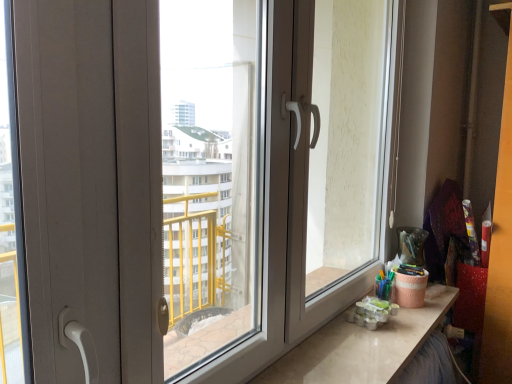
Question: Based on their sizes in the image, would you say transparent plastic window screen at center is bigger or smaller than matte white screen door at right?

Choices:
 (A) small
 (B) big

Answer: (A)

Question: Is point [x=162, y=119] closer or farther from the camera than point [x=354, y=241]?

Choices:
 (A) closer
 (B) farther

Answer: (A)

Question: Estimate the real-world distances between objects in this image. Which object is closer to the matte white counter top at lower right?

Choices:
 (A) transparent plastic window screen at center
 (B) matte white screen door at right

Answer: (B)

Question: Estimate the real-world distances between objects in this image. Which object is farther from the matte white screen door at right?

Choices:
 (A) transparent plastic window screen at center
 (B) matte white counter top at lower right

Answer: (A)